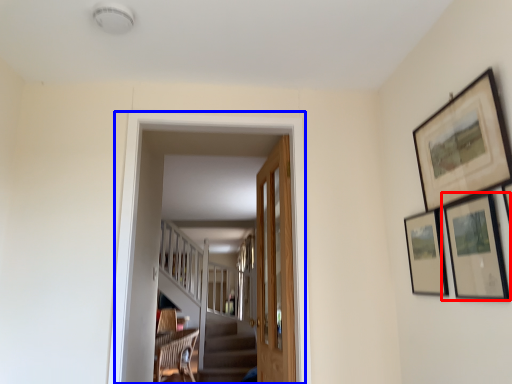
Question: Among these objects, which one is nearest to the camera, picture frame (highlighted by a red box) or corridor (highlighted by a blue box)?

Choices:
 (A) picture frame
 (B) corridor

Answer: (A)